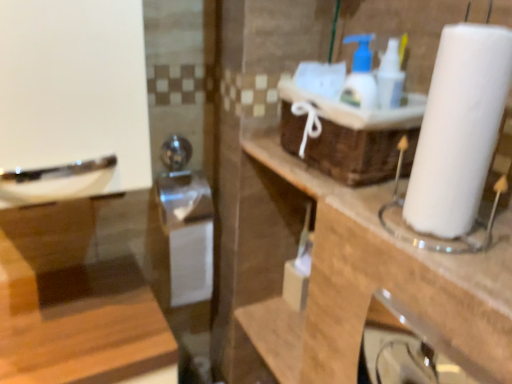
Question: Is brown woven basket at upper center in front of or behind white paper towel at right in the image?

Choices:
 (A) front
 (B) behind

Answer: (B)

Question: Choose the correct answer: Is brown woven basket at upper center inside white paper towel at right or outside it?

Choices:
 (A) outside
 (B) inside

Answer: (A)

Question: Considering the real-world distances, which object is farthest from the white paper at right?

Choices:
 (A) white paper towel at right
 (B) brown woven basket at upper center

Answer: (A)

Question: Estimate the real-world distances between objects in this image. Which object is closer to the white paper towel at right?

Choices:
 (A) brown woven basket at upper center
 (B) white paper at right

Answer: (A)